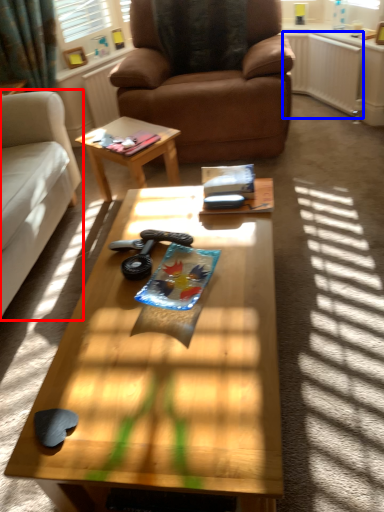
Question: Which of the following is the closest to the observer, studio couch (highlighted by a red box) or radiator (highlighted by a blue box)?

Choices:
 (A) studio couch
 (B) radiator

Answer: (A)